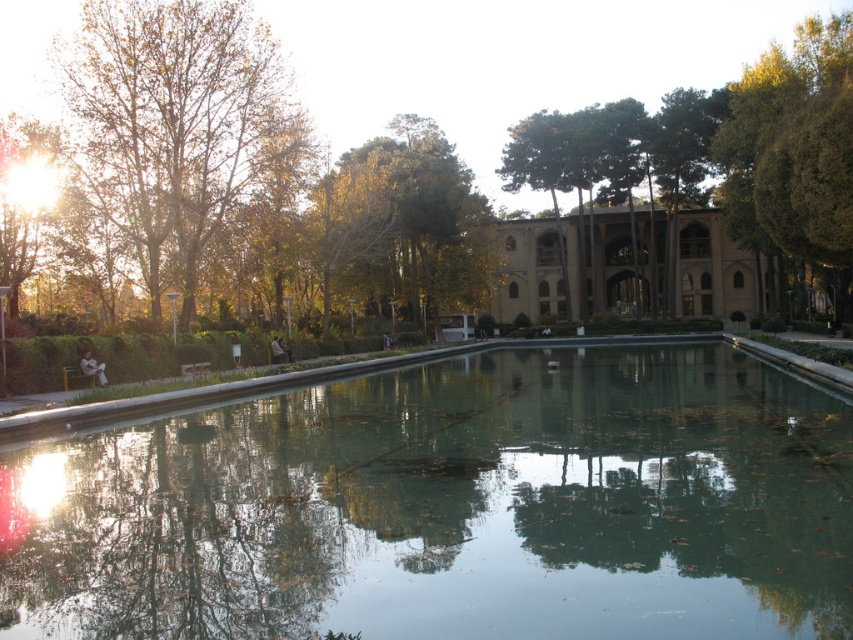
Question: Which point appears closest to the camera in this image?

Choices:
 (A) (273, 227)
 (B) (370, 230)
 (C) (483, 545)
 (D) (717, 253)

Answer: (C)

Question: Is green reflective water at center positioned before green leafy tree at center?

Choices:
 (A) no
 (B) yes

Answer: (B)

Question: Can you confirm if green reflective water at center is thinner than green leafy tree at center?

Choices:
 (A) no
 (B) yes

Answer: (A)

Question: In this image, where is green reflective water at center located relative to beige stone palace at center?

Choices:
 (A) right
 (B) left

Answer: (B)

Question: Estimate the real-world distances between objects in this image. Which object is farther from the green reflective water at center?

Choices:
 (A) beige stone palace at center
 (B) green leafy tree at center

Answer: (A)

Question: Which point is farther to the camera?

Choices:
 (A) beige stone palace at center
 (B) brown leafy tree at left
 (C) green reflective water at center

Answer: (A)